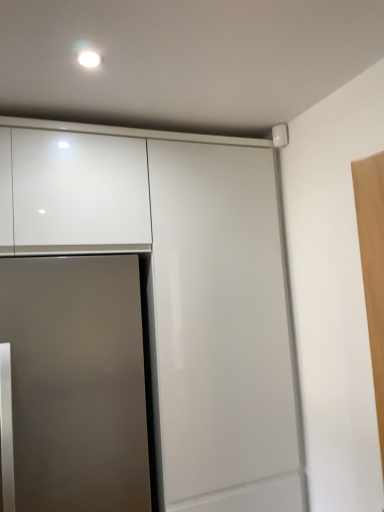
Question: Could you tell me if glossy white cabinet at upper center is facing satin silver door at lower left?

Choices:
 (A) no
 (B) yes

Answer: (B)

Question: Can you confirm if glossy white cabinet at upper center is bigger than satin silver door at lower left?

Choices:
 (A) yes
 (B) no

Answer: (A)

Question: From the image's perspective, is glossy white cabinet at upper center above satin silver door at lower left?

Choices:
 (A) no
 (B) yes

Answer: (B)

Question: Is the position of glossy white cabinet at upper center more distant than that of satin silver door at lower left?

Choices:
 (A) yes
 (B) no

Answer: (A)

Question: From a real-world perspective, is glossy white cabinet at upper center physically below satin silver door at lower left?

Choices:
 (A) no
 (B) yes

Answer: (A)

Question: Is glossy white cabinet at upper center at the right side of satin silver door at lower left?

Choices:
 (A) no
 (B) yes

Answer: (B)

Question: Can you confirm if satin silver door at lower left is positioned to the left of glossy white cabinet at upper center?

Choices:
 (A) yes
 (B) no

Answer: (A)

Question: From a real-world perspective, is satin silver door at lower left beneath glossy white cabinet at upper center?

Choices:
 (A) yes
 (B) no

Answer: (A)

Question: Is satin silver door at lower left turned away from glossy white cabinet at upper center?

Choices:
 (A) no
 (B) yes

Answer: (B)

Question: Considering the relative sizes of satin silver door at lower left and glossy white cabinet at upper center in the image provided, is satin silver door at lower left bigger than glossy white cabinet at upper center?

Choices:
 (A) yes
 (B) no

Answer: (B)

Question: Does satin silver door at lower left have a lesser height compared to glossy white cabinet at upper center?

Choices:
 (A) no
 (B) yes

Answer: (B)

Question: Is satin silver door at lower left further to the viewer compared to glossy white cabinet at upper center?

Choices:
 (A) no
 (B) yes

Answer: (A)

Question: Is glossy white cabinet at upper center spatially inside satin silver door at lower left, or outside of it?

Choices:
 (A) inside
 (B) outside

Answer: (A)